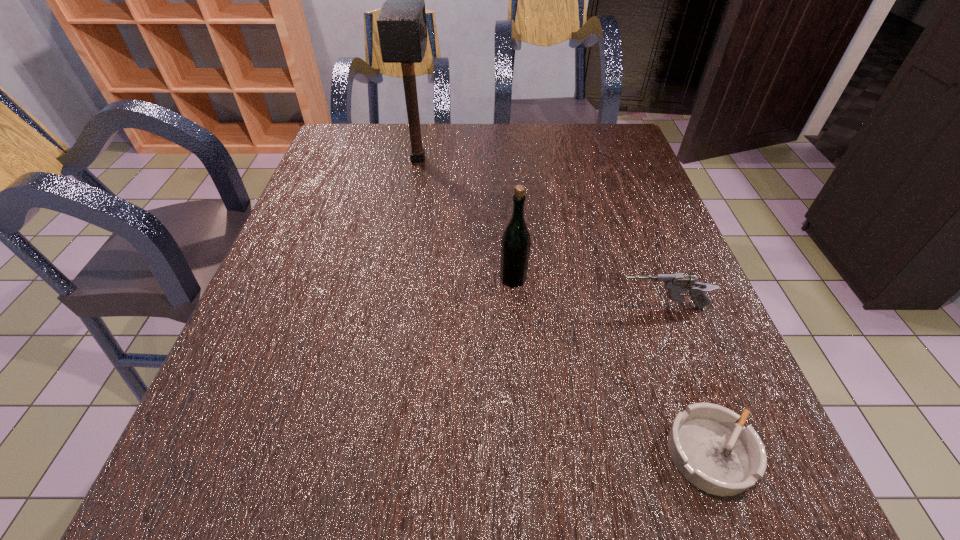
I want to click on the farthest object, so click(401, 22).

Identify the location of mallet. The width and height of the screenshot is (960, 540). (401, 22).

What are the coordinates of `beer bottle` in the screenshot? It's located at (515, 245).

At what (x,y) coordinates should I click in order to perform the action: click on the second object from left to right. Please return your answer as a coordinate pair (x, y). Looking at the image, I should click on (515, 245).

This screenshot has height=540, width=960. What are the coordinates of `the second nearest object` in the screenshot? It's located at (676, 283).

Locate an element on the screen. This screenshot has width=960, height=540. gun is located at coordinates (676, 283).

Find the location of a particular element. This screenshot has height=540, width=960. ashtray is located at coordinates (715, 452).

This screenshot has height=540, width=960. I want to click on the nearest object, so click(x=715, y=452).

Where is `vacant space situated on the left of the leftmost object`? The image size is (960, 540). vacant space situated on the left of the leftmost object is located at coordinates (372, 159).

At what (x,y) coordinates should I click in order to perform the action: click on free space located 0.250m on the left of the third nearest object. Please return your answer as a coordinate pair (x, y). Image resolution: width=960 pixels, height=540 pixels. Looking at the image, I should click on pyautogui.click(x=380, y=279).